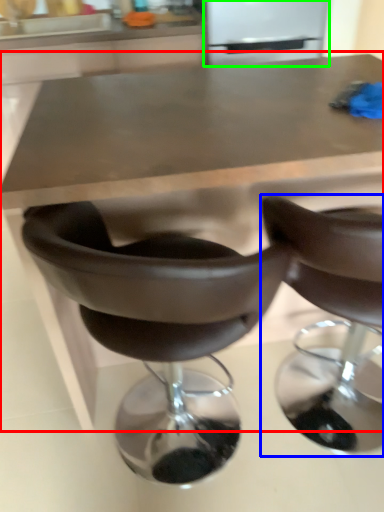
Question: Which object is positioned farthest from table (highlighted by a red box)? Select from chair (highlighted by a blue box) and appliance (highlighted by a green box).

Choices:
 (A) chair
 (B) appliance

Answer: (B)